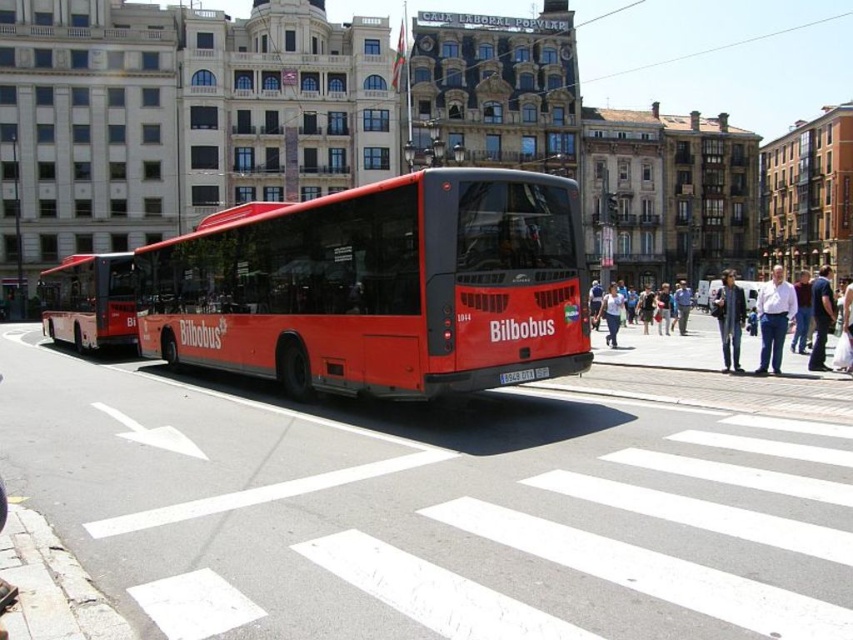
You are a pedestrian standing on the street in the image. You see two points marked on the road ahead. Which point is closer to you, the point at coordinates (62, 308) or the point at (682, 339)?

The point at coordinates (62, 308) is closer to you because it is further to the viewer than the point at (682, 339).

You are a fashion designer observing a street scene. You notice two items of clothing at the center of the image. Which item is taller between the light blue jeans at center and the denim jacket at center?

The light blue jeans at center has a greater height compared to the denim jacket at center, so the light blue jeans at center is taller.

You are standing at the pedestrian crossing in the image. You see a person wearing light blue jeans at center. Where is the point at coordinate [775,317] located on the person?

The point at coordinate [775,317] is located on the light blue jeans at center.